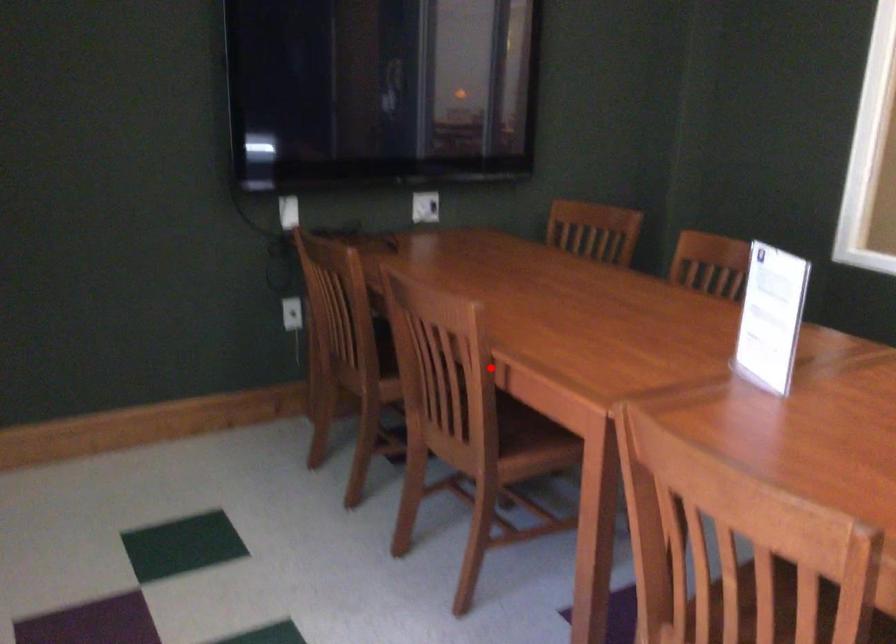
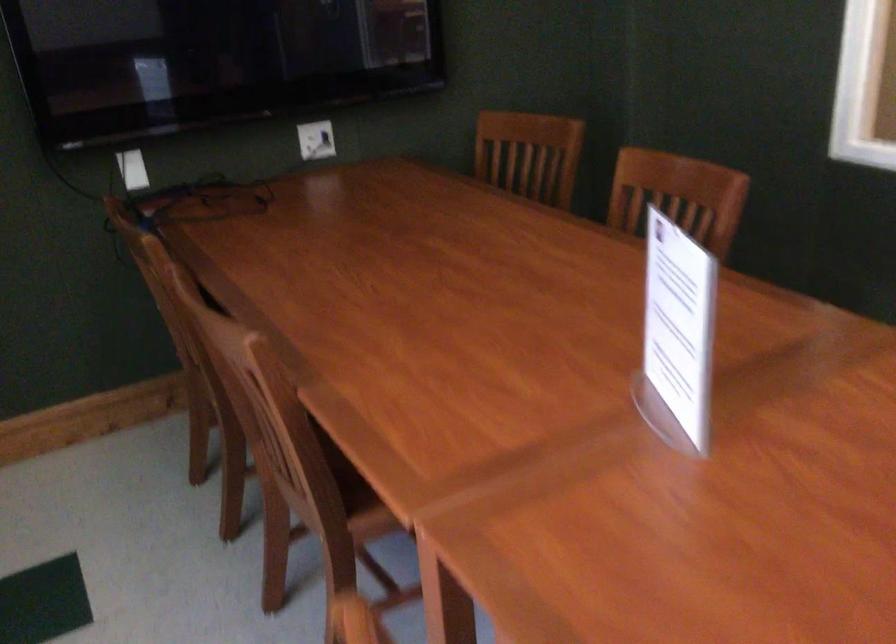
Question: I am providing you with two images of the same scene from different viewpoints. In image1, a red point is highlighted. Considering the same 3D point in image2, which of the following is correct?

Choices:
 (A) It is closer
 (B) It is farther

Answer: (A)